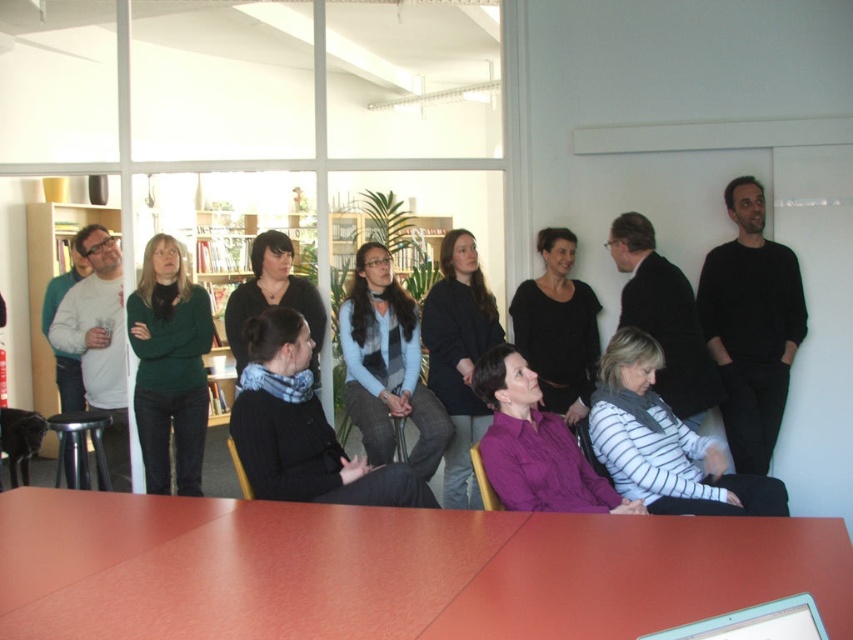
Between matte orange table at lower center and white striped sweater at lower center, which one is positioned higher?

Positioned higher is white striped sweater at lower center.

Who is more distant from viewer, (372, 563) or (747, 500)?

The point (747, 500) is more distant.

Where is `matte orange table at lower center`? Image resolution: width=853 pixels, height=640 pixels. matte orange table at lower center is located at coordinates (390, 570).

Does black matte sweater at right come behind black matte shirt at center?

Yes, black matte sweater at right is behind black matte shirt at center.

Does point (718, 273) come closer to viewer compared to point (564, 272)?

Yes.

Does point (753, 416) lie behind point (523, 321)?

No, (753, 416) is in front of (523, 321).

What are the coordinates of `black matte sweater at right` in the screenshot? It's located at (751, 324).

Can you confirm if black knit sweater at center is thinner than purple matte shirt at center?

Incorrect, black knit sweater at center's width is not less than purple matte shirt at center's.

Is point (312, 397) positioned behind point (453, 348)?

That is False.

Who is more forward, [250,365] or [457,440]?

Positioned in front is point [250,365].

Where is `black knit sweater at center`? black knit sweater at center is located at coordinates (303, 428).